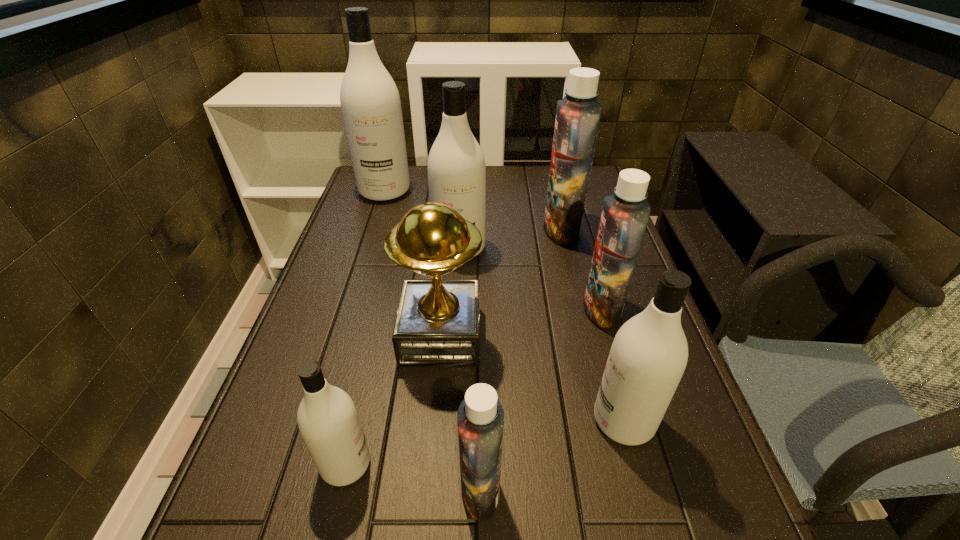
Locate an element on the screen. The height and width of the screenshot is (540, 960). the sixth closest object to the rightmost white shampoo is located at coordinates (x=578, y=114).

What are the coordinates of `the seventh closest object relative to the second smallest white shampoo` in the screenshot? It's located at coord(370,102).

The width and height of the screenshot is (960, 540). Identify the location of shampoo that is the sixth closest to the fourth nearest shampoo. pyautogui.click(x=370, y=102).

Point out which shampoo is positioned as the fourth nearest to the farthest blue shampoo. Please provide its 2D coordinates. Your answer should be formatted as a tuple, i.e. [(x, y)], where the tuple contains the x and y coordinates of a point satisfying the conditions above.

[(648, 356)]

This screenshot has width=960, height=540. Identify the location of white shampoo that is the fourth closest one to the farthest blue shampoo. (328, 421).

Locate an element on the screen. The width and height of the screenshot is (960, 540). the fourth closest white shampoo relative to the second nearest blue shampoo is located at coordinates (370, 102).

Locate an element on the screen. The width and height of the screenshot is (960, 540). blue shampoo that is the second closest to the farthest blue shampoo is located at coordinates (480, 419).

I want to click on the third closest blue shampoo relative to the gold award, so click(x=578, y=114).

You are a GUI agent. You are given a task and a screenshot of the screen. Output one action in this format:
    pyautogui.click(x=<x>, y=<y>)
    Task: Click on the free spot that satisfies the following two spatial constraints: 1. on the front label of the farthest blue shampoo; 2. on the front-facing side of the third white shampoo from left to right
    This screenshot has height=540, width=960.
    Given the screenshot: What is the action you would take?
    (566, 248)